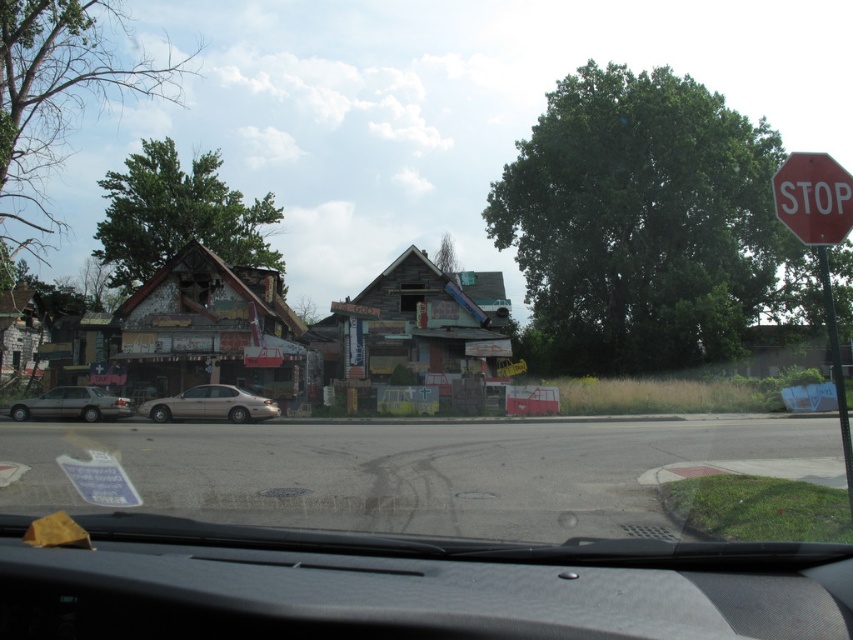
You are driving a car and need to check both the black textured dashboard at center and the metallic pole at right. Which object is closer to the driver?

The black textured dashboard at center is closer to the driver because it is positioned on the left side of the metallic pole at right, meaning it is nearer in the driver perspective.

You are driving a car and looking through the transparent glass windshield at lower center. You notice the red plastic stop sign at upper right in the distance. Which object appears larger to you?

The red plastic stop sign at upper right appears larger because it is closer to the observer than the transparent glass windshield at lower center, which is smaller in the scene.